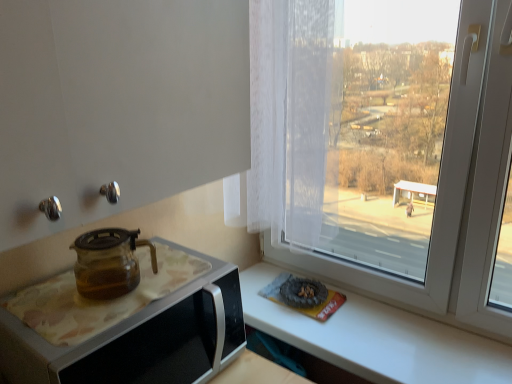
Describe the element at coordinates (109, 262) in the screenshot. This screenshot has width=512, height=384. I see `transparent glass teapot at left` at that location.

Locate an element on the screen. The height and width of the screenshot is (384, 512). transparent glass teapot at left is located at coordinates [x=109, y=262].

In order to face transparent glass teapot at left, should I rotate leftwards or rightwards?

You should rotate left by 16.216 degrees.

Describe the element at coordinates (127, 325) in the screenshot. The width and height of the screenshot is (512, 384). I see `transparent glass teapot at left` at that location.

The height and width of the screenshot is (384, 512). I want to click on transparent glass teapot at left, so point(127,325).

I want to click on transparent glass teapot at left, so click(109, 262).

Which object is positioned more to the left, transparent glass teapot at left or transparent glass teapot at left?

transparent glass teapot at left is more to the left.

Which object is further away from the camera taking this photo, transparent glass teapot at left or transparent glass teapot at left?

transparent glass teapot at left is further from the camera.

Considering the points (160, 267) and (108, 285), which point is behind, point (160, 267) or point (108, 285)?

The point (160, 267) is more distant.

From the image's perspective, is transparent glass teapot at left located above or below transparent glass teapot at left?

transparent glass teapot at left is situated lower than transparent glass teapot at left in the image.

From a real-world perspective, which object rests below the other?

From a 3D spatial view, transparent glass teapot at left is below.

Which of these two, transparent glass teapot at left or transparent glass teapot at left, is thinner?

transparent glass teapot at left.

Which of these two, transparent glass teapot at left or transparent glass teapot at left, stands shorter?

With less height is transparent glass teapot at left.

Looking at this image, can you confirm if transparent glass teapot at left is smaller than transparent glass teapot at left?

No, transparent glass teapot at left is not smaller than transparent glass teapot at left.

Is transparent glass teapot at left surrounded by transparent glass teapot at left?

Definitely not — transparent glass teapot at left is not inside transparent glass teapot at left.

Is transparent glass teapot at left positioned far away from transparent glass teapot at left?

No, there isn't a large distance between transparent glass teapot at left and transparent glass teapot at left.

Could you tell me if transparent glass teapot at left is facing transparent glass teapot at left?

No, transparent glass teapot at left is not facing towards transparent glass teapot at left.

What's the angular difference between transparent glass teapot at left and transparent glass teapot at left's facing directions?

0.000114 degrees separate the facing orientations of transparent glass teapot at left and transparent glass teapot at left.

Locate an element on the screen. appliance in front of the transparent glass teapot at left is located at coordinates (127, 325).

Can you confirm if transparent glass teapot at left is positioned to the left of transparent glass teapot at left?

Correct, you'll find transparent glass teapot at left to the left of transparent glass teapot at left.

Which object is closer to the camera, transparent glass teapot at left or transparent glass teapot at left?

transparent glass teapot at left is closer to the camera.

Which is closer to the camera, (124, 232) or (186, 341)?

Point (124, 232) is positioned farther from the camera compared to point (186, 341).

From the image's perspective, is transparent glass teapot at left positioned above or below transparent glass teapot at left?

transparent glass teapot at left is situated higher than transparent glass teapot at left in the image.

From a real-world perspective, relative to transparent glass teapot at left, is transparent glass teapot at left vertically above or below?

In terms of real-world spatial position, transparent glass teapot at left is above transparent glass teapot at left.

Which of these two, transparent glass teapot at left or transparent glass teapot at left, is wider?

transparent glass teapot at left.

Considering the relative sizes of transparent glass teapot at left and transparent glass teapot at left in the image provided, is transparent glass teapot at left shorter than transparent glass teapot at left?

Correct, transparent glass teapot at left is not as tall as transparent glass teapot at left.

Is transparent glass teapot at left smaller than transparent glass teapot at left?

Correct, transparent glass teapot at left occupies less space than transparent glass teapot at left.

Can we say transparent glass teapot at left lies outside transparent glass teapot at left?

Indeed, transparent glass teapot at left is completely outside transparent glass teapot at left.

Is transparent glass teapot at left with transparent glass teapot at left?

No, transparent glass teapot at left is not touching transparent glass teapot at left.

Does transparent glass teapot at left turn towards transparent glass teapot at left?

No, transparent glass teapot at left is not facing towards transparent glass teapot at left.

How many degrees apart are the facing directions of transparent glass teapot at left and transparent glass teapot at left?

The angle between the facing direction of transparent glass teapot at left and the facing direction of transparent glass teapot at left is 0.000114 degrees.

This screenshot has width=512, height=384. Find the location of `kitchen appliance that appears above the transparent glass teapot at left (from a real-world perspective)`. kitchen appliance that appears above the transparent glass teapot at left (from a real-world perspective) is located at coordinates (109, 262).

The height and width of the screenshot is (384, 512). I want to click on kitchen appliance located above the transparent glass teapot at left (from a real-world perspective), so click(109, 262).

The width and height of the screenshot is (512, 384). What are the coordinates of `appliance lying below the transparent glass teapot at left (from the image's perspective)` in the screenshot? It's located at (127, 325).